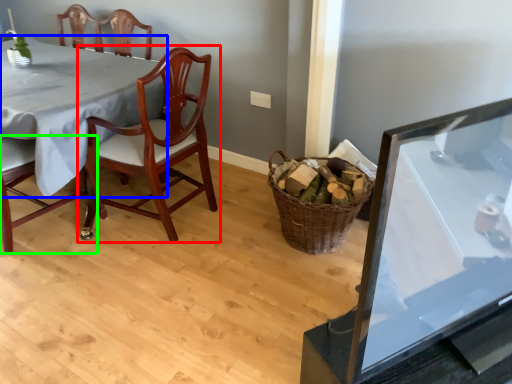
Question: Based on their relative distances, which object is farther from chair (highlighted by a red box)? Choose from table (highlighted by a blue box) and chair (highlighted by a green box).

Choices:
 (A) table
 (B) chair

Answer: (B)